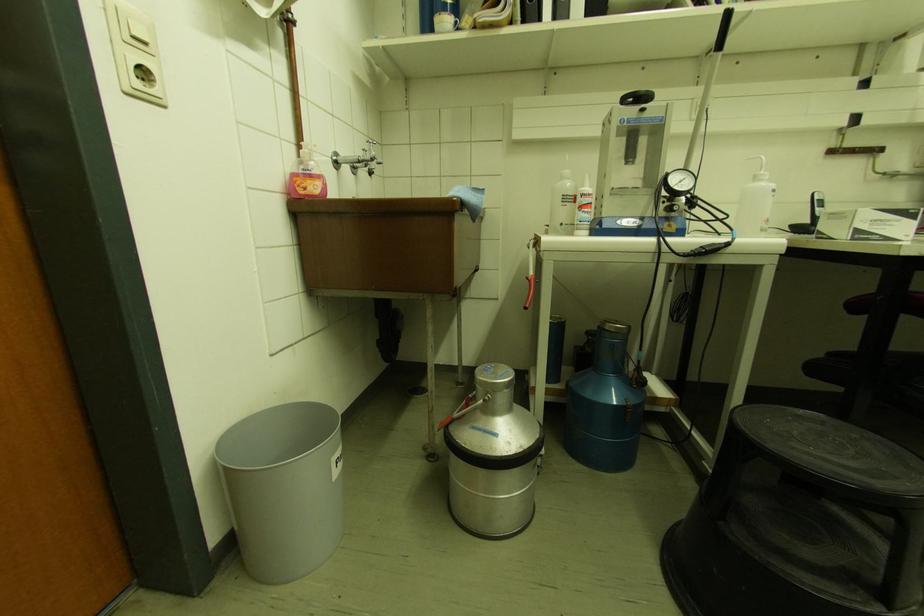
Where is `red locking lever`? This screenshot has height=616, width=924. red locking lever is located at coordinates (529, 291).